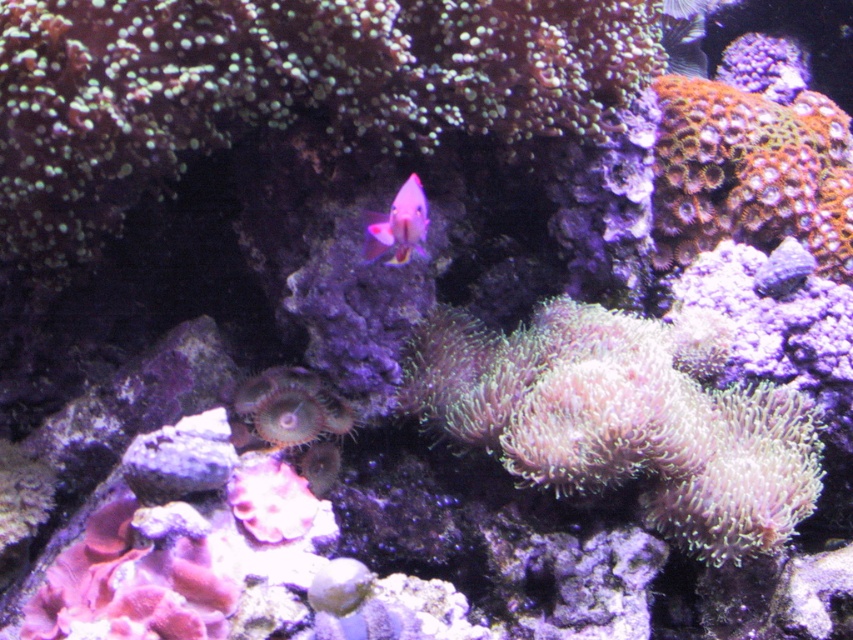
Does green translucent coral at center appear over pink glossy fish at center?

No.

Who is positioned more to the left, green translucent coral at center or pink glossy fish at center?

green translucent coral at center is more to the left.

Is point (299, 412) positioned before point (404, 198)?

No, (299, 412) is further to viewer.

Image resolution: width=853 pixels, height=640 pixels. Find the location of `green translucent coral at center`. green translucent coral at center is located at coordinates (291, 406).

In the scene shown: Can you confirm if green translucent coral at center is positioned below purple coral at center?

Correct, green translucent coral at center is located below purple coral at center.

Does green translucent coral at center have a lesser height compared to purple coral at center?

Correct, green translucent coral at center is not as tall as purple coral at center.

Which is behind, point (247, 396) or point (799, 282)?

Positioned behind is point (799, 282).

Find the location of a particular element. The image size is (853, 640). green translucent coral at center is located at coordinates (291, 406).

Which is above, pink glossy fish at center or purple coral at center?

pink glossy fish at center

Is pink glossy fish at center further to the viewer compared to purple coral at center?

No, pink glossy fish at center is in front of purple coral at center.

Where is `pink glossy fish at center`? This screenshot has height=640, width=853. pink glossy fish at center is located at coordinates (398, 225).